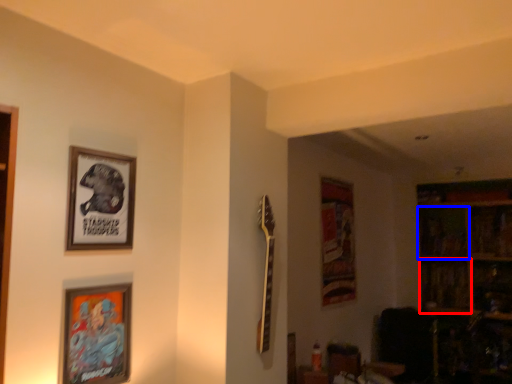
Question: Which point is further to the camera, shelf (highlighted by a red box) or shelf (highlighted by a blue box)?

Choices:
 (A) shelf
 (B) shelf

Answer: (B)